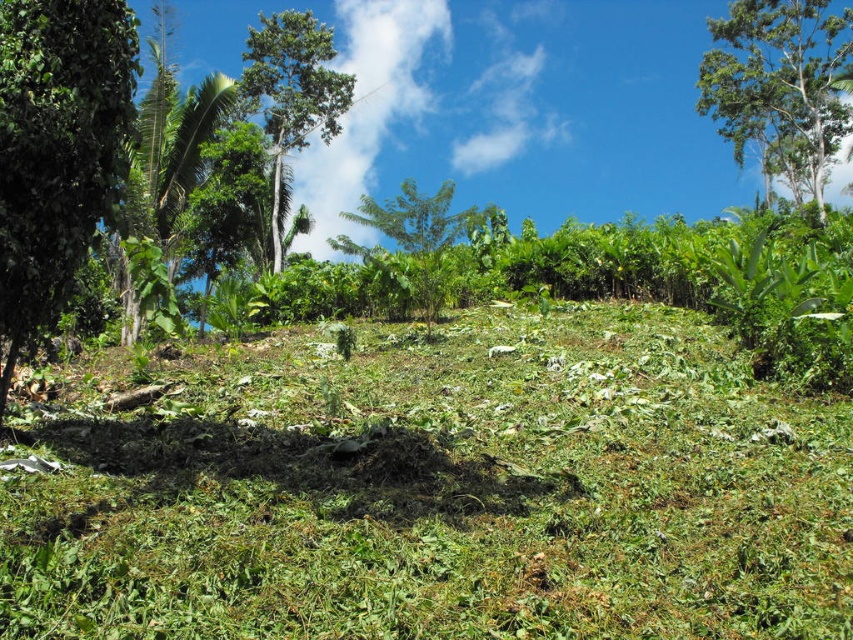
Question: Which of these objects is positioned closest to the green leafy grass at center?

Choices:
 (A) green leafy tree at center
 (B) green leafy tree at upper right
 (C) green leafy tree at left

Answer: (C)

Question: Is green leafy tree at left to the left of green leafy tree at upper right from the viewer's perspective?

Choices:
 (A) yes
 (B) no

Answer: (A)

Question: Which object is positioned farthest from the green leafy tree at center?

Choices:
 (A) green leafy grass at center
 (B) green leafy tree at upper right
 (C) green leafy tree at left

Answer: (B)

Question: Which object appears closest to the camera in this image?

Choices:
 (A) green leafy tree at center
 (B) green leafy tree at upper right
 (C) green leafy tree at upper left
 (D) green leafy tree at left

Answer: (D)

Question: Can you confirm if green leafy grass at center is positioned above green leafy tree at upper right?

Choices:
 (A) yes
 (B) no

Answer: (B)

Question: Can you confirm if green leafy grass at center is wider than green leafy tree at upper right?

Choices:
 (A) no
 (B) yes

Answer: (B)